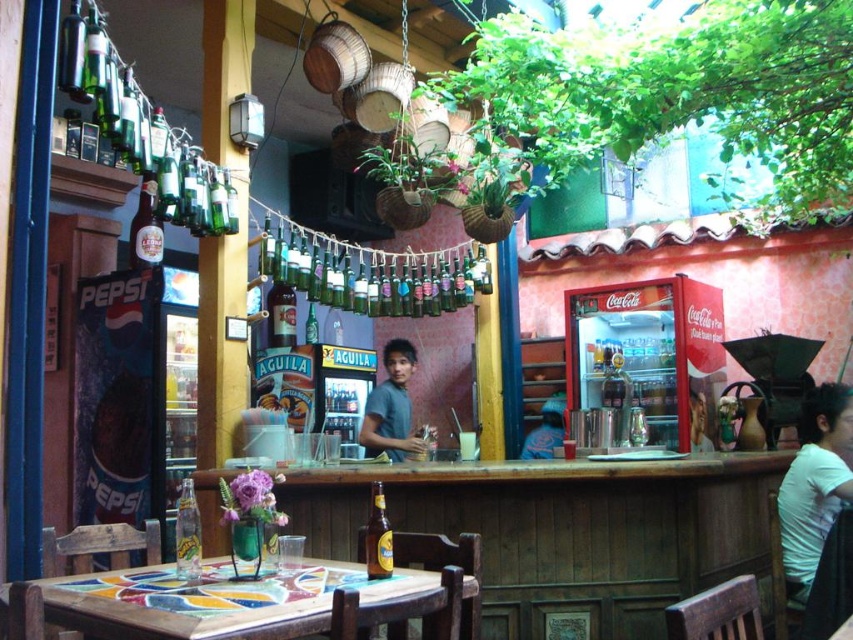
You are a customer sitting at the table and want to grab the golden glass bottle at center. Which direction should you reach to pick up the translucent glass bottle at table center?

The translucent glass bottle at table center is on the left side of the golden glass bottle at center, so you should reach to your left to pick up the translucent glass bottle at table center.